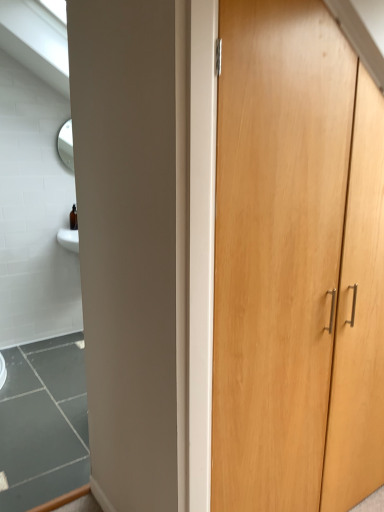
Question: Considering the relative sizes of light wood cupboard at right and white glossy window at upper left in the image provided, is light wood cupboard at right thinner than white glossy window at upper left?

Choices:
 (A) yes
 (B) no

Answer: (A)

Question: From a real-world perspective, is light wood cupboard at right on white glossy window at upper left?

Choices:
 (A) no
 (B) yes

Answer: (A)

Question: Is light wood cupboard at right positioned far away from white glossy window at upper left?

Choices:
 (A) no
 (B) yes

Answer: (B)

Question: Is light wood cupboard at right shorter than white glossy window at upper left?

Choices:
 (A) yes
 (B) no

Answer: (B)

Question: Is light wood cupboard at right at the left side of white glossy window at upper left?

Choices:
 (A) no
 (B) yes

Answer: (A)

Question: Does light wood cupboard at right have a greater height compared to white glossy window at upper left?

Choices:
 (A) no
 (B) yes

Answer: (B)

Question: Does white glossy window at upper left turn towards light wood cupboard at right?

Choices:
 (A) yes
 (B) no

Answer: (B)

Question: Is white glossy window at upper left next to light wood cupboard at right and touching it?

Choices:
 (A) yes
 (B) no

Answer: (B)

Question: Is white glossy window at upper left looking in the opposite direction of light wood cupboard at right?

Choices:
 (A) yes
 (B) no

Answer: (B)

Question: Considering the relative sizes of white glossy window at upper left and light wood cupboard at right in the image provided, is white glossy window at upper left shorter than light wood cupboard at right?

Choices:
 (A) yes
 (B) no

Answer: (A)

Question: From a real-world perspective, is white glossy window at upper left located beneath light wood cupboard at right?

Choices:
 (A) yes
 (B) no

Answer: (B)

Question: From a real-world perspective, does white glossy window at upper left stand above light wood cupboard at right?

Choices:
 (A) no
 (B) yes

Answer: (B)

Question: From a real-world perspective, relative to white glossy window at upper left, is light wood cupboard at right vertically above or below?

Choices:
 (A) above
 (B) below

Answer: (B)